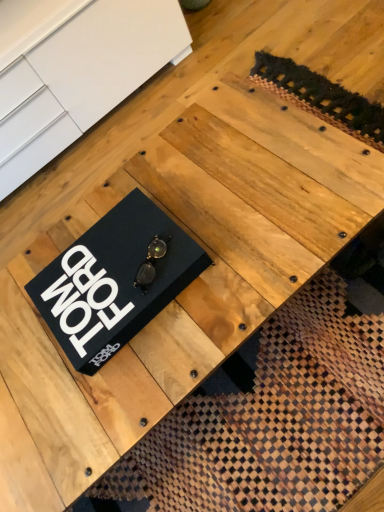
Locate an element on the screen. vacant area located to the right-hand side of black matte box at center is located at coordinates (225, 204).